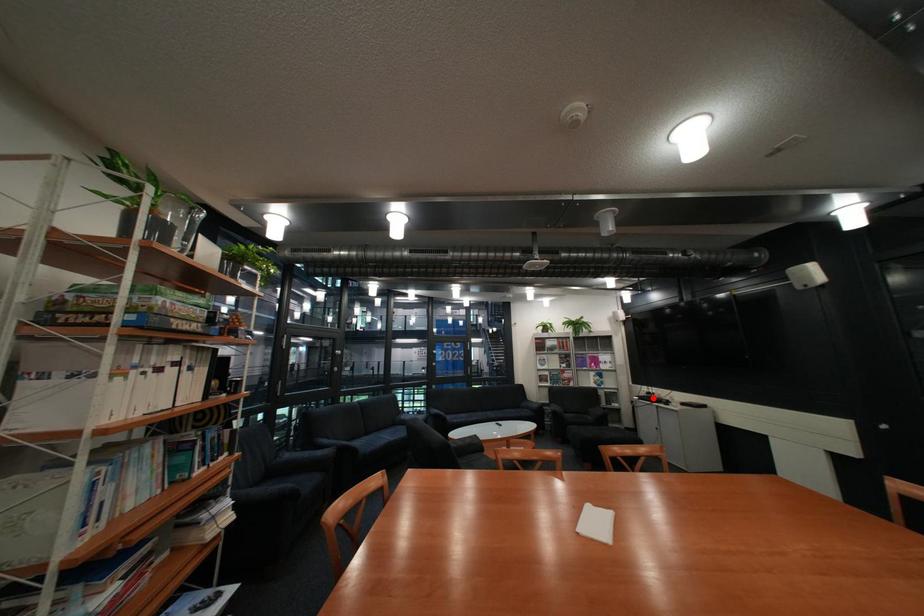
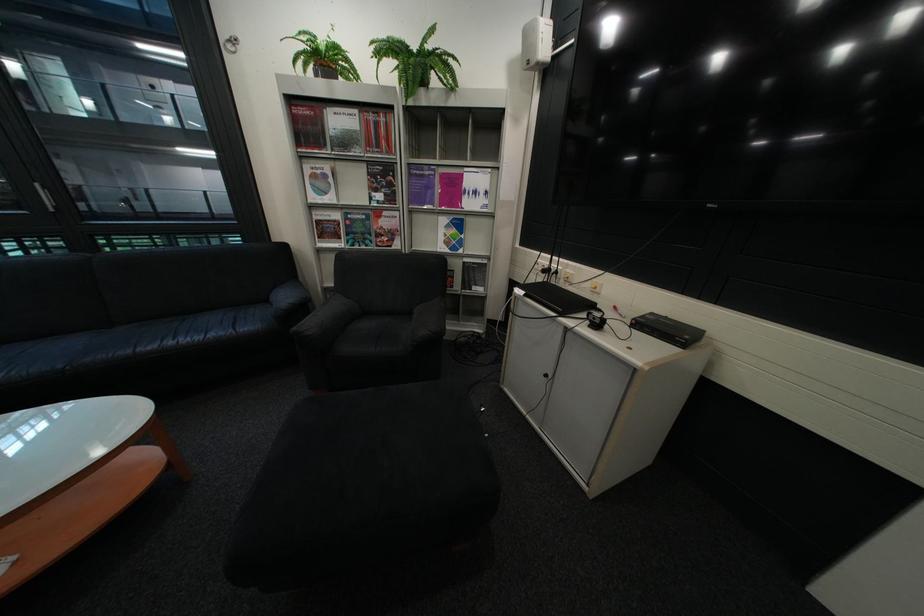
Question: I am providing you with two images of the same scene from different viewpoints. A red point is shown in image1. For the corresponding object point in image2, is it positioned nearer or farther from the camera?

Choices:
 (A) Nearer
 (B) Farther

Answer: (A)